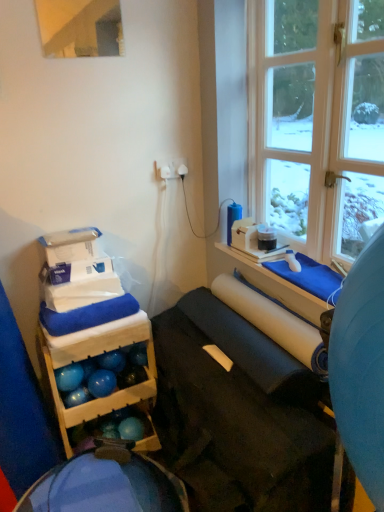
Question: Looking at the image, does white matte paper towel at center seem bigger or smaller compared to matte black yoga mat at center?

Choices:
 (A) small
 (B) big

Answer: (A)

Question: Is point (322, 361) closer or farther from the camera than point (220, 408)?

Choices:
 (A) farther
 (B) closer

Answer: (B)

Question: Based on their relative distances, which object is farther from the wooden storage at left?

Choices:
 (A) matte black yoga mat at center
 (B) clear glass window at upper right
 (C) blue fabric bean bag at lower left
 (D) white matte paper towel at center

Answer: (B)

Question: Estimate the real-world distances between objects in this image. Which object is closer to the clear glass window at upper right?

Choices:
 (A) wooden storage at left
 (B) blue fabric bean bag at lower left
 (C) matte black yoga mat at center
 (D) white matte paper towel at center

Answer: (D)